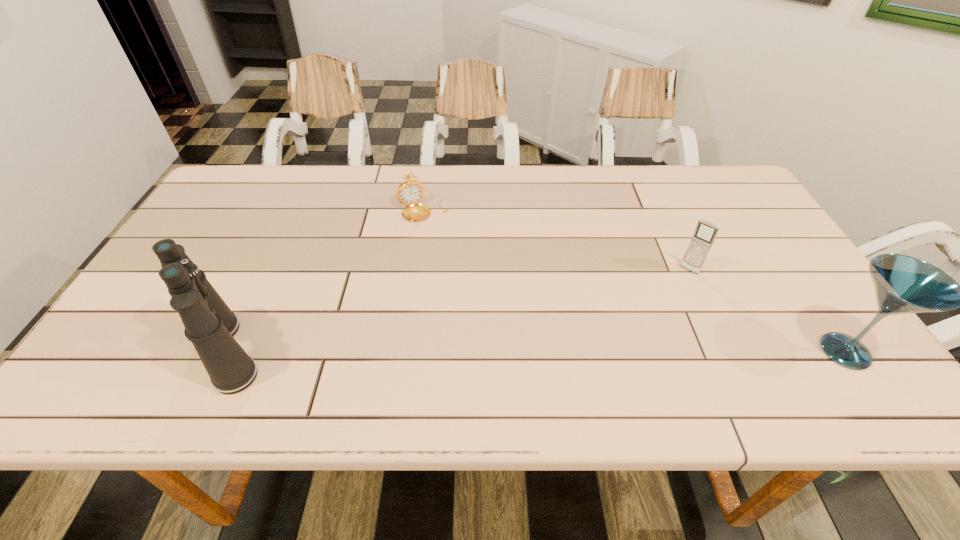
Where is `the tallest object`? Image resolution: width=960 pixels, height=540 pixels. the tallest object is located at coordinates (210, 325).

The image size is (960, 540). I want to click on the leftmost object, so click(210, 325).

In order to click on martini in this screenshot , I will do `click(903, 284)`.

Where is `the third shortest object`? The height and width of the screenshot is (540, 960). the third shortest object is located at coordinates (903, 284).

Image resolution: width=960 pixels, height=540 pixels. In order to click on cellular telephone in this screenshot , I will do `click(706, 231)`.

Identify the location of the third object from left to right. The width and height of the screenshot is (960, 540). (706, 231).

This screenshot has height=540, width=960. I want to click on pocket watch, so click(x=410, y=192).

The height and width of the screenshot is (540, 960). I want to click on the third object from right to left, so click(410, 192).

At what (x,y) coordinates should I click in order to perform the action: click on free region located 0.230m on the back of the leftmost object. Please return your answer as a coordinate pair (x, y). The width and height of the screenshot is (960, 540). Looking at the image, I should click on (277, 248).

At what (x,y) coordinates should I click in order to perform the action: click on free space located 0.400m on the back of the rightmost object. Please return your answer as a coordinate pair (x, y). Image resolution: width=960 pixels, height=540 pixels. Looking at the image, I should click on (752, 216).